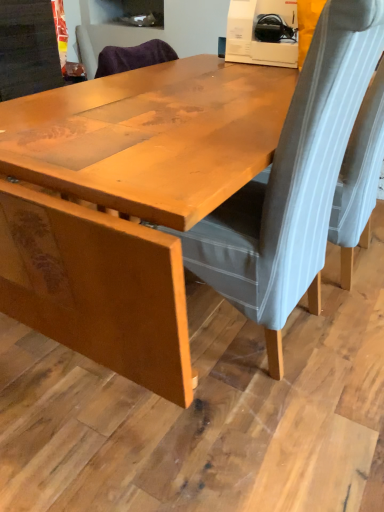
The width and height of the screenshot is (384, 512). Describe the element at coordinates (359, 178) in the screenshot. I see `gray fabric chair at right, the second chair when ordered from left to right` at that location.

Describe the element at coordinates (134, 199) in the screenshot. This screenshot has width=384, height=512. I see `wooden table at center` at that location.

At what (x,y) coordinates should I click in order to perform the action: click on gray fabric chair at right, the 1th chair when ordered from right to left. Please return your answer as a coordinate pair (x, y). Image resolution: width=384 pixels, height=512 pixels. Looking at the image, I should click on (359, 178).

How different are the orientations of wooden table at center and velvet grey chair at center, the second chair in the right-to-left sequence, in degrees?

There is a 93.1-degree angle between the facing directions of wooden table at center and velvet grey chair at center, the second chair in the right-to-left sequence.

Does point (162, 159) lie behind point (361, 3)?

Yes.

Is wooden table at center oriented away from velvet grey chair at center, the second chair in the right-to-left sequence?

wooden table at center is not turned away from velvet grey chair at center, the second chair in the right-to-left sequence.

From a real-world perspective, who is located higher, wooden table at center or velvet grey chair at center, the 1th chair in the left-to-right sequence?

velvet grey chair at center, the 1th chair in the left-to-right sequence.

From a real-world perspective, which is physically above, gray fabric chair at right, the 1th chair when ordered from right to left, or velvet grey chair at center, the second chair in the right-to-left sequence?

velvet grey chair at center, the second chair in the right-to-left sequence.

Is gray fabric chair at right, the 1th chair when ordered from right to left, inside or outside of velvet grey chair at center, the 1th chair in the left-to-right sequence?

gray fabric chair at right, the 1th chair when ordered from right to left, is not inside velvet grey chair at center, the 1th chair in the left-to-right sequence, it's outside.

Between velvet grey chair at center, the second chair in the right-to-left sequence, and wooden table at center, which one has less height?

Standing shorter between the two is wooden table at center.

Considering the positions of objects velvet grey chair at center, the second chair in the right-to-left sequence, and wooden table at center in the image provided, who is behind, velvet grey chair at center, the second chair in the right-to-left sequence, or wooden table at center?

velvet grey chair at center, the second chair in the right-to-left sequence, is more distant.

Which object is wider, velvet grey chair at center, the second chair in the right-to-left sequence, or wooden table at center?

wooden table at center is wider.

Can you confirm if velvet grey chair at center, the second chair in the right-to-left sequence, is positioned to the left of wooden table at center?

No, velvet grey chair at center, the second chair in the right-to-left sequence, is not to the left of wooden table at center.

Can you confirm if gray fabric chair at right, the 1th chair when ordered from right to left, is bigger than wooden table at center?

Incorrect, gray fabric chair at right, the 1th chair when ordered from right to left, is not larger than wooden table at center.

Considering the relative positions of gray fabric chair at right, the 1th chair when ordered from right to left, and wooden table at center in the image provided, is gray fabric chair at right, the 1th chair when ordered from right to left, to the left of wooden table at center from the viewer's perspective?

No.

Which of these two, gray fabric chair at right, the second chair when ordered from left to right, or wooden table at center, stands shorter?

Standing shorter between the two is wooden table at center.

From a real-world perspective, is gray fabric chair at right, the 1th chair when ordered from right to left, physically above wooden table at center?

Indeed, from a real-world perspective, gray fabric chair at right, the 1th chair when ordered from right to left, stands above wooden table at center.

Who is more distant, velvet grey chair at center, the second chair in the right-to-left sequence, or gray fabric chair at right, the second chair when ordered from left to right?

Answer: gray fabric chair at right, the second chair when ordered from left to right, is behind.

Can gray fabric chair at right, the 1th chair when ordered from right to left, be found inside velvet grey chair at center, the second chair in the right-to-left sequence?

That's incorrect, gray fabric chair at right, the 1th chair when ordered from right to left, is not inside velvet grey chair at center, the second chair in the right-to-left sequence.

Can you confirm if velvet grey chair at center, the second chair in the right-to-left sequence, is positioned to the right of gray fabric chair at right, the 1th chair when ordered from right to left?

In fact, velvet grey chair at center, the second chair in the right-to-left sequence, is to the left of gray fabric chair at right, the 1th chair when ordered from right to left.

Is velvet grey chair at center, the second chair in the right-to-left sequence, thinner than gray fabric chair at right, the 1th chair when ordered from right to left?

No, velvet grey chair at center, the second chair in the right-to-left sequence, is not thinner than gray fabric chair at right, the 1th chair when ordered from right to left.

Is wooden table at center bigger than gray fabric chair at right, the 1th chair when ordered from right to left?

Indeed, wooden table at center has a larger size compared to gray fabric chair at right, the 1th chair when ordered from right to left.

Is point (107, 323) less distant than point (355, 143)?

Yes, it is.

Is gray fabric chair at right, the 1th chair when ordered from right to left, a part of wooden table at center?

No, gray fabric chair at right, the 1th chair when ordered from right to left, is located outside of wooden table at center.

Is wooden table at center thinner than gray fabric chair at right, the 1th chair when ordered from right to left?

In fact, wooden table at center might be wider than gray fabric chair at right, the 1th chair when ordered from right to left.

The height and width of the screenshot is (512, 384). Find the location of `the 1st chair behind the wooden table at center`. the 1st chair behind the wooden table at center is located at coordinates (292, 183).

What are the coordinates of `chair on the right of velvet grey chair at center, the second chair in the right-to-left sequence` in the screenshot? It's located at (359, 178).

Looking at this image, which object lies further to the anchor point velvet grey chair at center, the second chair in the right-to-left sequence, wooden table at center or gray fabric chair at right, the second chair when ordered from left to right?

Among the two, gray fabric chair at right, the second chair when ordered from left to right, is located further to velvet grey chair at center, the second chair in the right-to-left sequence.

Based on their spatial positions, is wooden table at center or velvet grey chair at center, the 1th chair in the left-to-right sequence, closer to gray fabric chair at right, the second chair when ordered from left to right?

velvet grey chair at center, the 1th chair in the left-to-right sequence.

Estimate the real-world distances between objects in this image. Which object is further from wooden table at center, gray fabric chair at right, the second chair when ordered from left to right, or velvet grey chair at center, the second chair in the right-to-left sequence?

gray fabric chair at right, the second chair when ordered from left to right, is further to wooden table at center.

Estimate the real-world distances between objects in this image. Which object is further from velvet grey chair at center, the second chair in the right-to-left sequence, gray fabric chair at right, the 1th chair when ordered from right to left, or wooden table at center?

Based on the image, gray fabric chair at right, the 1th chair when ordered from right to left, appears to be further to velvet grey chair at center, the second chair in the right-to-left sequence.

Which object lies further to the anchor point gray fabric chair at right, the second chair when ordered from left to right, velvet grey chair at center, the second chair in the right-to-left sequence, or wooden table at center?

wooden table at center is positioned further to the anchor gray fabric chair at right, the second chair when ordered from left to right.

Estimate the real-world distances between objects in this image. Which object is further from wooden table at center, velvet grey chair at center, the 1th chair in the left-to-right sequence, or gray fabric chair at right, the second chair when ordered from left to right?

gray fabric chair at right, the second chair when ordered from left to right.

This screenshot has width=384, height=512. What are the coordinates of `chair between wooden table at center and gray fabric chair at right, the 1th chair when ordered from right to left, from left to right` in the screenshot? It's located at (292, 183).